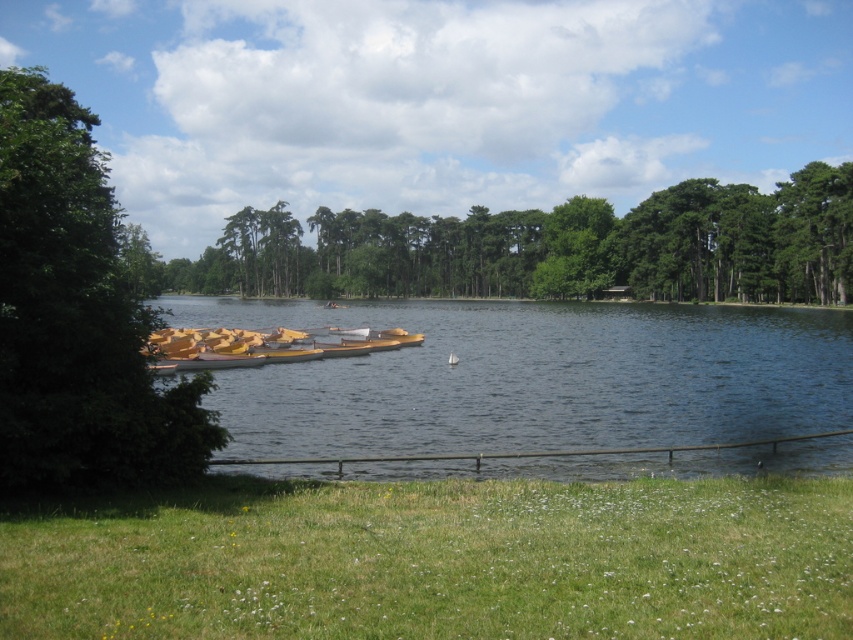
Question: Which of the following is the farthest from the observer?

Choices:
 (A) (33, 314)
 (B) (650, 236)
 (C) (54, 608)

Answer: (B)

Question: Which object appears farthest from the camera in this image?

Choices:
 (A) green leafy tree at left
 (B) green leafy trees at center
 (C) yellow wood boats at center

Answer: (B)

Question: Does clear blue water at center appear on the right side of green leafy tree at left?

Choices:
 (A) yes
 (B) no

Answer: (A)

Question: Which point is farther to the camera?

Choices:
 (A) (817, 164)
 (B) (213, 360)
 (C) (434, 321)
 (D) (666, 500)

Answer: (A)

Question: Is green grass at lower center above yellow wood boats at center?

Choices:
 (A) no
 (B) yes

Answer: (A)

Question: Does clear blue water at center appear on the right side of green leafy trees at center?

Choices:
 (A) yes
 (B) no

Answer: (A)